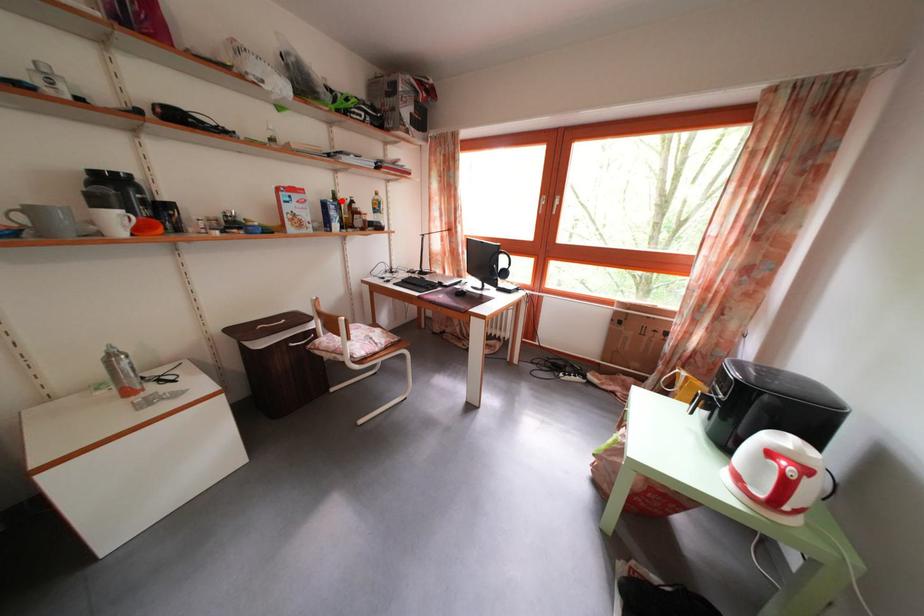
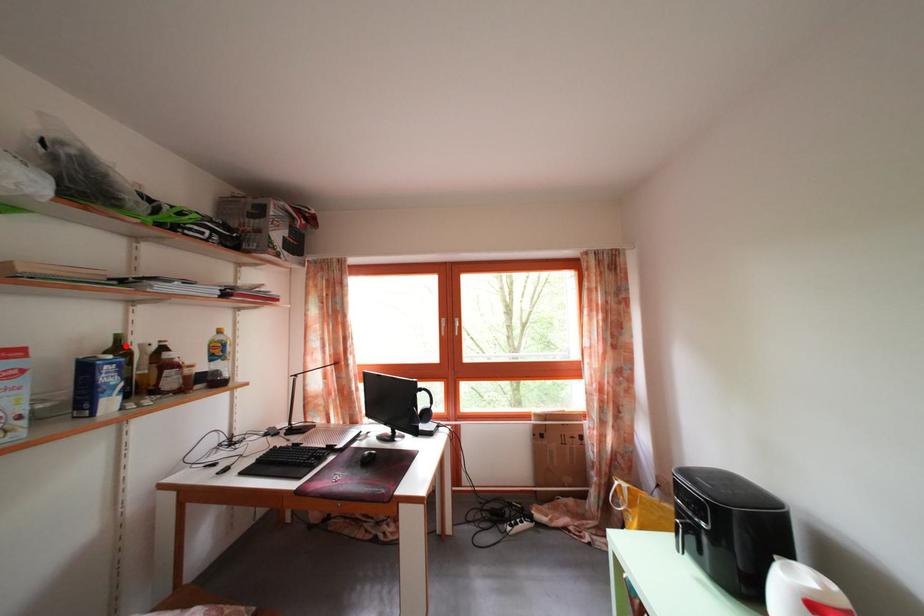
I am providing you with two images of the same scene from different viewpoints. A red point is marked on the first image and another point is marked on the second image. Are the points marked in image1 and image2 representing the same 3D position?

Yes